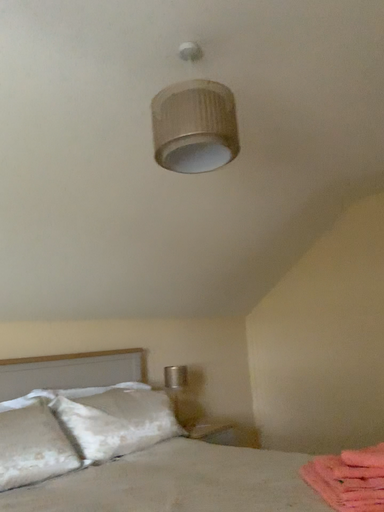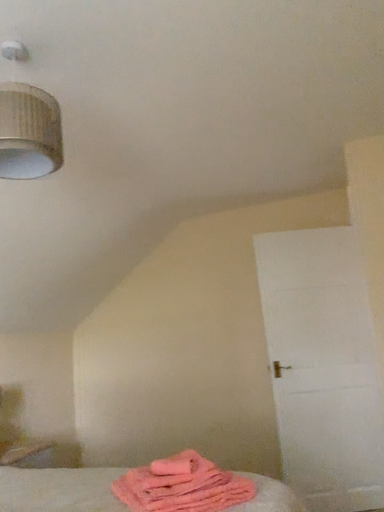
Question: How did the camera likely rotate when shooting the video?

Choices:
 (A) rotated left
 (B) rotated right

Answer: (B)